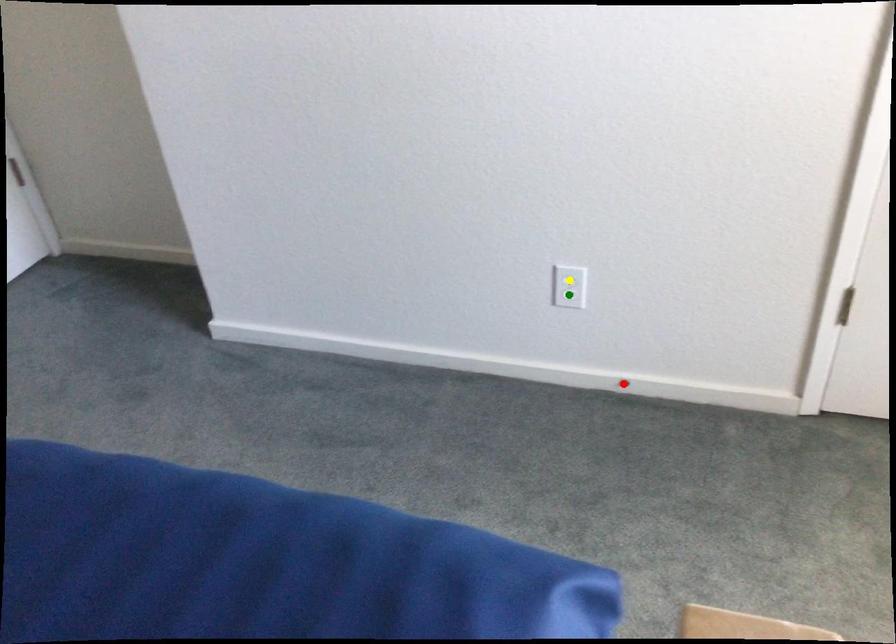
Order these from nearest to farthest:
- red point
- green point
- yellow point

1. red point
2. green point
3. yellow point